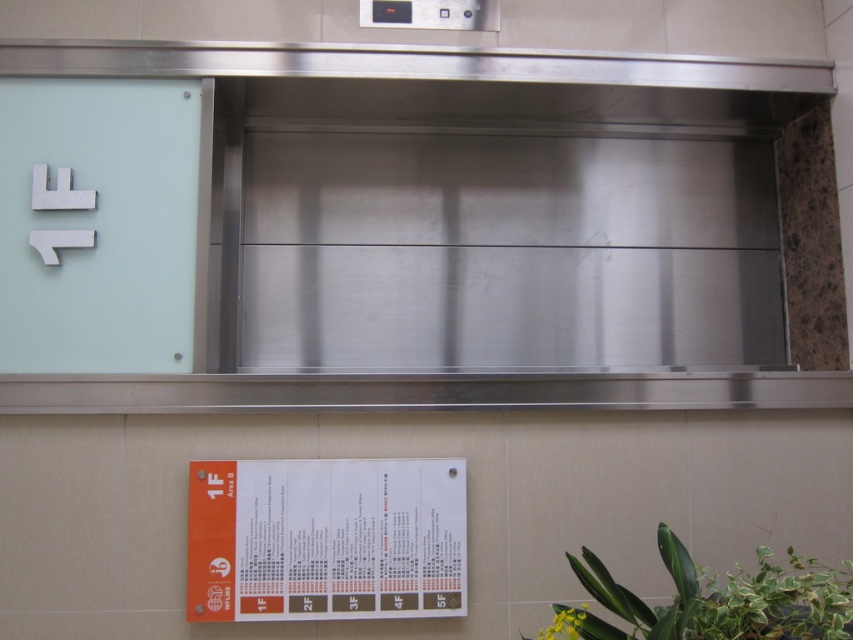
Is orange paper at lower center below green leafy plant at lower right?

Actually, orange paper at lower center is above green leafy plant at lower right.

Is orange paper at lower center to the right of green leafy plant at lower right from the viewer's perspective?

In fact, orange paper at lower center is to the left of green leafy plant at lower right.

Is point (347, 504) behind point (637, 604)?

Yes, it is.

Locate an element on the screen. The height and width of the screenshot is (640, 853). orange paper at lower center is located at coordinates click(326, 540).